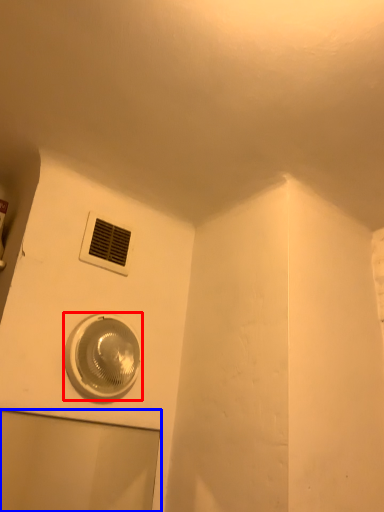
Question: Among these objects, which one is nearest to the camera, home appliance (highlighted by a red box) or glass door (highlighted by a blue box)?

Choices:
 (A) home appliance
 (B) glass door

Answer: (B)